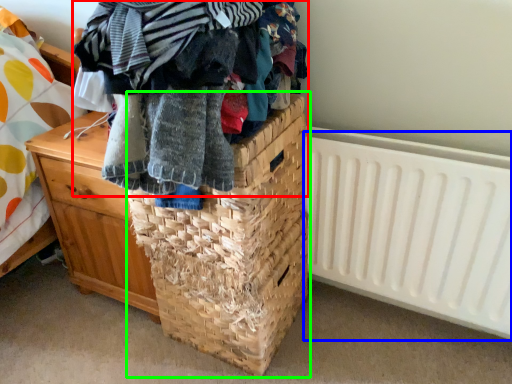
Question: Considering the real-world distances, which object is closest to clothing (highlighted by a red box)? radiator (highlighted by a blue box) or basket (highlighted by a green box).

Choices:
 (A) radiator
 (B) basket

Answer: (B)